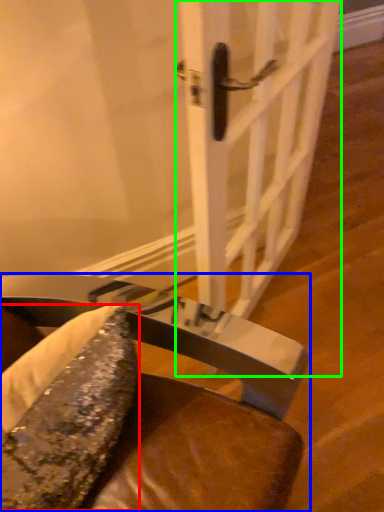
Question: Which is nearer to the food (highlighted by a red box)? chair (highlighted by a blue box) or door (highlighted by a green box).

Choices:
 (A) chair
 (B) door

Answer: (A)